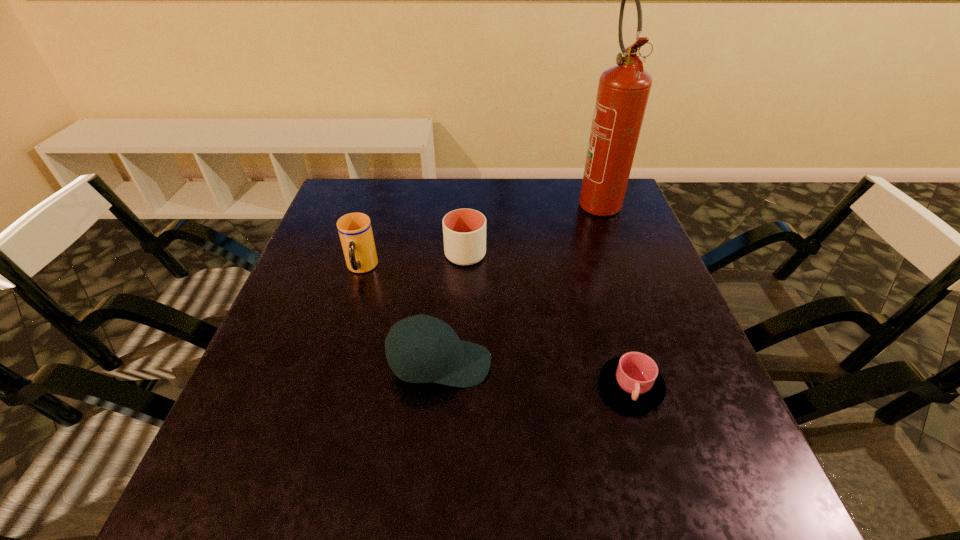
I want to click on vacant region between the nearest cup and the farthest object, so click(x=614, y=293).

Where is `vacant space that is in between the baseball cap and the rightmost cup`? This screenshot has height=540, width=960. vacant space that is in between the baseball cap and the rightmost cup is located at coordinates (536, 375).

Where is `free space between the fire extinguisher and the nearest cup`? The height and width of the screenshot is (540, 960). free space between the fire extinguisher and the nearest cup is located at coordinates (614, 293).

Find the location of `the closest object to the farthest object`. the closest object to the farthest object is located at coordinates (464, 230).

Locate an element on the screen. Image resolution: width=960 pixels, height=540 pixels. object that is the fourth closest to the tallest cup is located at coordinates (623, 91).

You are a GUI agent. You are given a task and a screenshot of the screen. Output one action in this format:
    pyautogui.click(x=<x>, y=<y>)
    Task: Click on the closest cup to the baseball cap
    
    Given the screenshot: What is the action you would take?
    pyautogui.click(x=355, y=231)

Identify which cup is the closest to the fire extinguisher. Please provide its 2D coordinates. Your answer should be formatted as a tuple, i.e. [(x, y)], where the tuple contains the x and y coordinates of a point satisfying the conditions above.

[(464, 230)]

Locate an element on the screen. This screenshot has height=540, width=960. free region that satisfies the following two spatial constraints: 1. on the front side of the second shortest cup; 2. on the front-facing side of the baseball cap is located at coordinates (461, 364).